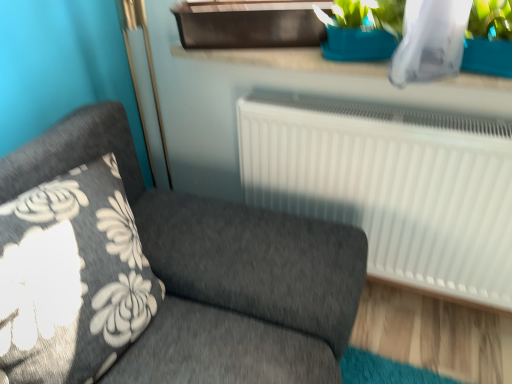
The image size is (512, 384). What do you see at coordinates (214, 237) in the screenshot?
I see `dark gray fabric couch at left` at bounding box center [214, 237].

The width and height of the screenshot is (512, 384). I want to click on dark gray fabric couch at left, so click(214, 237).

Where is `blue plastic window sill at upper center`? This screenshot has height=384, width=512. blue plastic window sill at upper center is located at coordinates (284, 60).

In order to face blue plastic window sill at upper center, should I rotate leftwards or rightwards?

To align with it, rotate right about 9.801°.

Describe the element at coordinates (284, 60) in the screenshot. The width and height of the screenshot is (512, 384). I see `blue plastic window sill at upper center` at that location.

The image size is (512, 384). Find the location of `dark gray fabric couch at left`. dark gray fabric couch at left is located at coordinates (214, 237).

Which is more to the left, blue plastic window sill at upper center or dark gray fabric couch at left?

From the viewer's perspective, dark gray fabric couch at left appears more on the left side.

Which object is closer to the camera taking this photo, blue plastic window sill at upper center or dark gray fabric couch at left?

dark gray fabric couch at left.

Considering the positions of point (352, 67) and point (324, 295), is point (352, 67) closer or farther from the camera than point (324, 295)?

Clearly, point (352, 67) is more distant from the camera than point (324, 295).

From the image's perspective, would you say blue plastic window sill at upper center is shown under dark gray fabric couch at left?

No, from the image's perspective, blue plastic window sill at upper center is not below dark gray fabric couch at left.

From a real-world perspective, is blue plastic window sill at upper center on top of dark gray fabric couch at left?

Yes, from a real-world perspective, blue plastic window sill at upper center is over dark gray fabric couch at left

Can you confirm if blue plastic window sill at upper center is thinner than dark gray fabric couch at left?

Indeed, blue plastic window sill at upper center has a lesser width compared to dark gray fabric couch at left.

Considering the relative sizes of blue plastic window sill at upper center and dark gray fabric couch at left in the image provided, is blue plastic window sill at upper center taller than dark gray fabric couch at left?

No.

Based on their sizes in the image, would you say blue plastic window sill at upper center is bigger or smaller than dark gray fabric couch at left?

In the image, blue plastic window sill at upper center appears to be smaller than dark gray fabric couch at left.

Based on the photo, is dark gray fabric couch at left located within blue plastic window sill at upper center?

No, blue plastic window sill at upper center does not contain dark gray fabric couch at left.

Are blue plastic window sill at upper center and dark gray fabric couch at left making contact?

No, blue plastic window sill at upper center is not making contact with dark gray fabric couch at left.

Does blue plastic window sill at upper center turn towards dark gray fabric couch at left?

Yes, blue plastic window sill at upper center faces towards dark gray fabric couch at left.

Can you tell me how much blue plastic window sill at upper center and dark gray fabric couch at left differ in facing direction?

There is a 90-degree angle between the facing directions of blue plastic window sill at upper center and dark gray fabric couch at left.

Find the location of `window sill that is above the dark gray fabric couch at left (from the image's perspective)`. window sill that is above the dark gray fabric couch at left (from the image's perspective) is located at coordinates (284, 60).

Is dark gray fabric couch at left to the left or to the right of blue plastic window sill at upper center in the image?

dark gray fabric couch at left is to the left of blue plastic window sill at upper center.

Does dark gray fabric couch at left come in front of blue plastic window sill at upper center?

That is True.

Considering the positions of point (99, 133) and point (291, 63), is point (99, 133) closer or farther from the camera than point (291, 63)?

Point (99, 133) is positioned closer to the camera compared to point (291, 63).

From the image's perspective, which is above, dark gray fabric couch at left or blue plastic window sill at upper center?

blue plastic window sill at upper center.

From a real-world perspective, is dark gray fabric couch at left physically below blue plastic window sill at upper center?

Correct, in the physical world, dark gray fabric couch at left is lower than blue plastic window sill at upper center.

Consider the image. Which object is thinner, dark gray fabric couch at left or blue plastic window sill at upper center?

blue plastic window sill at upper center.

Between dark gray fabric couch at left and blue plastic window sill at upper center, which one has more height?

Standing taller between the two is dark gray fabric couch at left.

Based on the photo, who is smaller, dark gray fabric couch at left or blue plastic window sill at upper center?

blue plastic window sill at upper center.

Based on the photo, is blue plastic window sill at upper center surrounded by dark gray fabric couch at left?

No.

Are dark gray fabric couch at left and blue plastic window sill at upper center located far from each other?

No, dark gray fabric couch at left is in close proximity to blue plastic window sill at upper center.

Is dark gray fabric couch at left looking in the opposite direction of blue plastic window sill at upper center?

No, dark gray fabric couch at left's orientation is not away from blue plastic window sill at upper center.

This screenshot has width=512, height=384. In order to click on furniture below the blue plastic window sill at upper center (from the image's perspective) in this screenshot , I will do `click(214, 237)`.

What are the coordinates of `window sill behind the dark gray fabric couch at left` in the screenshot? It's located at (284, 60).

Find the location of a particular element. furniture that is in front of the blue plastic window sill at upper center is located at coordinates (214, 237).